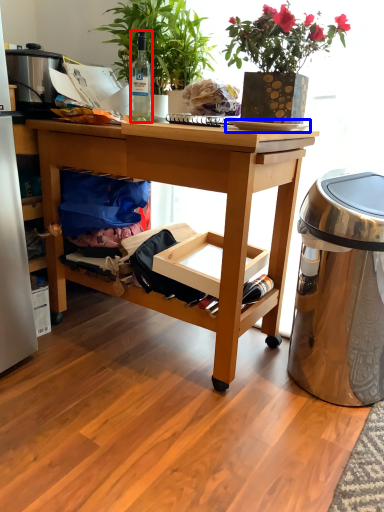
Question: Which object appears closest to the camera in this image, bottle (highlighted by a red box) or plate (highlighted by a blue box)?

Choices:
 (A) bottle
 (B) plate

Answer: (B)